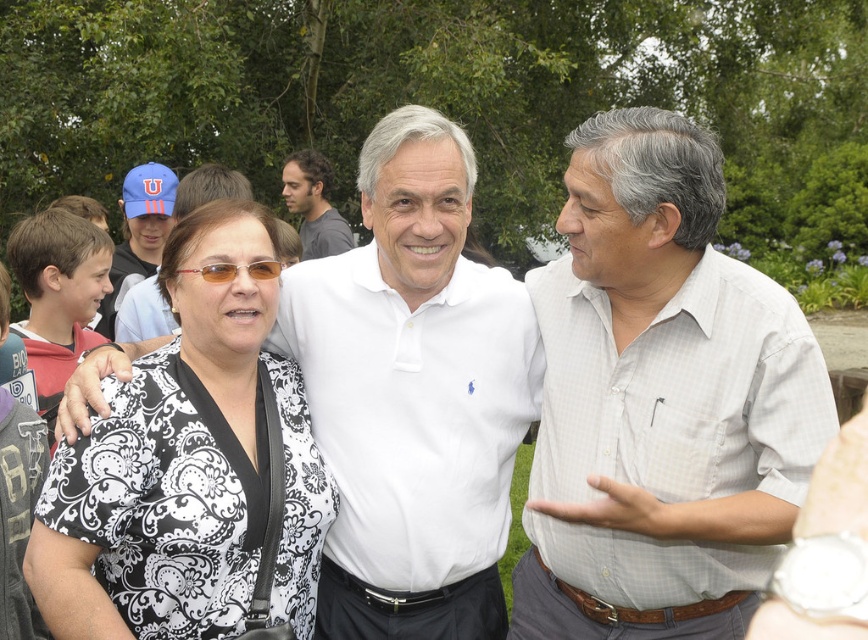
Question: Which object is positioned farthest from the dark gray shirt at upper center?

Choices:
 (A) blue fabric cap at upper left
 (B) white cotton shirt at center

Answer: (B)

Question: Considering the relative positions of white cotton shirt at center and dark gray shirt at upper center in the image provided, where is white cotton shirt at center located with respect to dark gray shirt at upper center?

Choices:
 (A) left
 (B) right

Answer: (B)

Question: Does white checkered shirt at center have a lesser width compared to black printed blouse at center?

Choices:
 (A) no
 (B) yes

Answer: (A)

Question: Which point is farther to the camera?

Choices:
 (A) white checkered shirt at center
 (B) white cotton shirt at center
 (C) black printed blouse at center

Answer: (B)

Question: Is white checkered shirt at center below white cotton shirt at center?

Choices:
 (A) yes
 (B) no

Answer: (A)

Question: Which object appears farthest from the camera in this image?

Choices:
 (A) white checkered shirt at center
 (B) black printed blouse at center

Answer: (B)